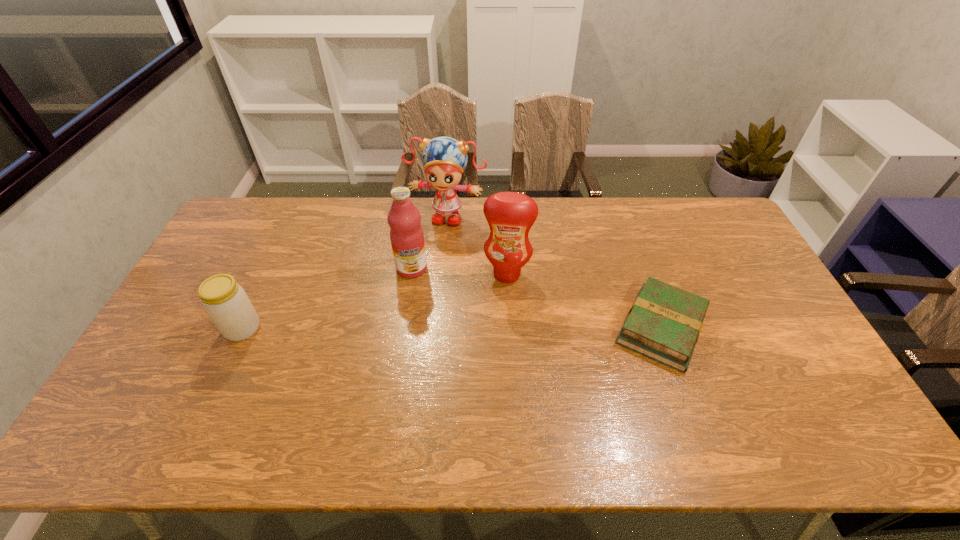
You are a GUI agent. You are given a task and a screenshot of the screen. Output one action in this format:
    pyautogui.click(x=<x>, y=<y>)
    Task: Click on the free space between the condiment and the farthest object
    The height and width of the screenshot is (540, 960).
    Given the screenshot: What is the action you would take?
    pyautogui.click(x=477, y=244)

Locate an element on the screen. The width and height of the screenshot is (960, 540). free space between the condiment and the jar is located at coordinates (374, 301).

This screenshot has height=540, width=960. Identify the location of empty space that is in between the doll and the fruit juice. click(429, 241).

Find the location of a particular element. This screenshot has width=960, height=540. empty space between the doll and the jar is located at coordinates (345, 271).

Find the location of a particular element. This screenshot has width=960, height=540. the closest object relative to the doll is located at coordinates tap(406, 234).

Locate an element on the screen. The image size is (960, 540). the second closest object to the fourth tallest object is located at coordinates (444, 159).

Locate an element on the screen. This screenshot has width=960, height=540. vacant position in the image that satisfies the following two spatial constraints: 1. on the front side of the condiment; 2. on the left side of the fruit juice is located at coordinates [x=411, y=274].